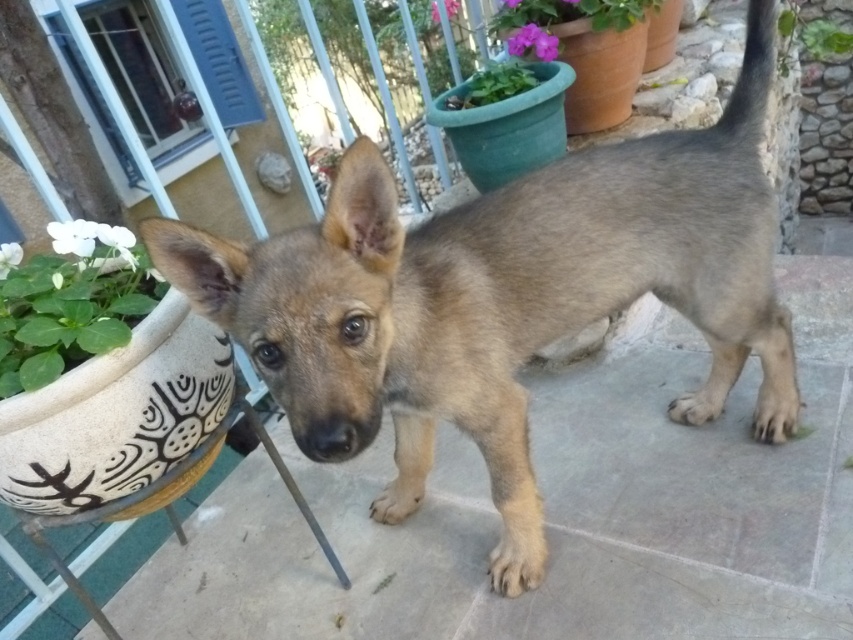
Which is more to the right, fuzzy brown puppy at center or green leafy plant at upper right?

Positioned to the right is green leafy plant at upper right.

Between fuzzy brown puppy at center and green leafy plant at upper right, which one is positioned lower?

fuzzy brown puppy at center

Is point (508, 214) positioned before point (782, 61)?

Yes, point (508, 214) is in front of point (782, 61).

In order to click on fuzzy brown puppy at center in this screenshot , I will do `click(503, 296)`.

Can you confirm if fuzzy brown puppy at center is taller than green leafy plant at lower left?

Indeed, fuzzy brown puppy at center has a greater height compared to green leafy plant at lower left.

From the picture: Does fuzzy brown puppy at center have a lesser height compared to green leafy plant at lower left?

In fact, fuzzy brown puppy at center may be taller than green leafy plant at lower left.

Find the location of `fuzzy brown puppy at center`. fuzzy brown puppy at center is located at coordinates (503, 296).

Where is `fuzzy brown puppy at center`? The image size is (853, 640). fuzzy brown puppy at center is located at coordinates (503, 296).

Consider the image. Does green leafy plant at lower left appear over green leafy plant at upper right?

No, green leafy plant at lower left is not above green leafy plant at upper right.

Can you confirm if green leafy plant at lower left is thinner than green leafy plant at upper right?

Yes, green leafy plant at lower left is thinner than green leafy plant at upper right.

Find the location of a particular element. green leafy plant at lower left is located at coordinates (68, 301).

The image size is (853, 640). In order to click on green leafy plant at lower left in this screenshot , I will do click(x=68, y=301).